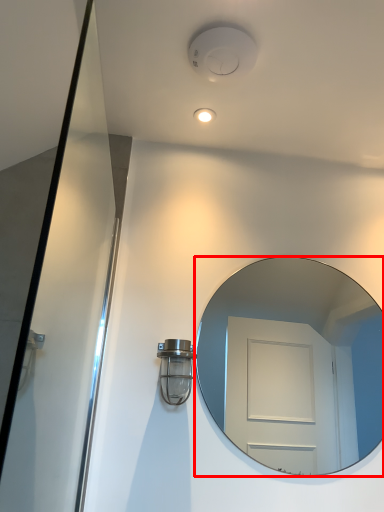
Question: Where is mirror (annotated by the red box) located in relation to light fixture in the image?

Choices:
 (A) right
 (B) left

Answer: (A)